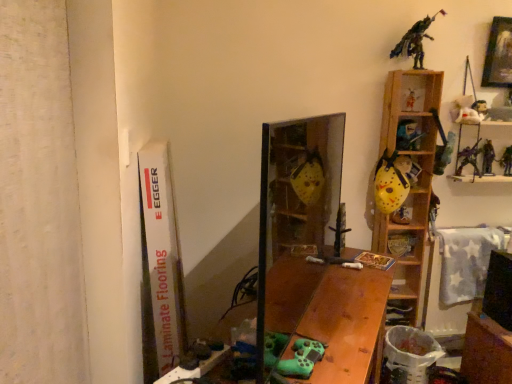
Find the location of a particular element. This screenshot has width=512, height=384. vacant space that's between black plastic sword at center, the 11th toy in the right-to-left sequence, and green matte controller at lower center, arranged as the 12th toy when viewed from the right is located at coordinates (327, 300).